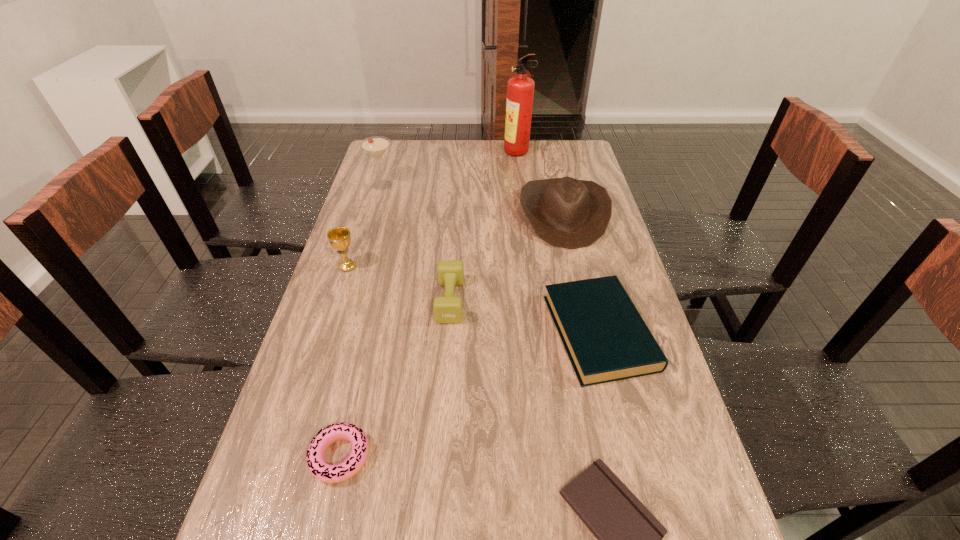
Image resolution: width=960 pixels, height=540 pixels. I want to click on chalice located at the left edge, so click(339, 237).

Find the location of a particular element. Image resolution: width=960 pixels, height=540 pixels. doughnut that is positioned at the left edge is located at coordinates (352, 465).

Locate an element on the screen. cowboy hat that is at the right edge is located at coordinates (566, 212).

You are a GUI agent. You are given a task and a screenshot of the screen. Output one action in this format:
    pyautogui.click(x=<x>, y=<y>)
    Task: Click on the book located at the right edge
    Image resolution: width=960 pixels, height=540 pixels.
    Given the screenshot: What is the action you would take?
    pyautogui.click(x=606, y=339)

This screenshot has height=540, width=960. I want to click on vacant region at the far edge of the desktop, so click(x=436, y=151).

The height and width of the screenshot is (540, 960). I want to click on vacant space at the left edge of the desktop, so coord(391,254).

This screenshot has width=960, height=540. What are the coordinates of `free point at the right edge` in the screenshot? It's located at (580, 279).

In the image, there is a desktop. Where is `vacant space at the far left corner`? The width and height of the screenshot is (960, 540). vacant space at the far left corner is located at coordinates pyautogui.click(x=397, y=150).

At what (x,y) coordinates should I click in order to perform the action: click on vacant area that lies between the fourth farthest object and the martini. Please return your answer as a coordinate pair (x, y). Image resolution: width=960 pixels, height=540 pixels. Looking at the image, I should click on (365, 226).

Locate an element on the screen. free point between the cowboy hat and the fifth nearest object is located at coordinates (456, 241).